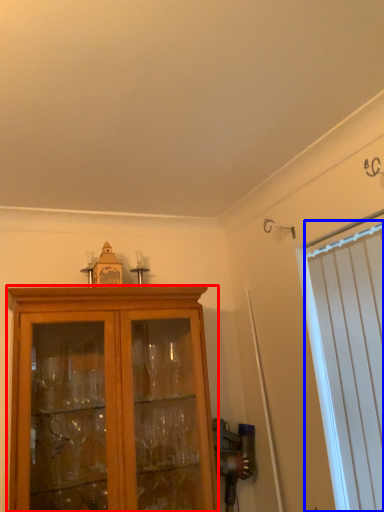
Question: Which object appears farthest to the camera in this image, cabinetry (highlighted by a red box) or curtain (highlighted by a blue box)?

Choices:
 (A) cabinetry
 (B) curtain

Answer: (A)